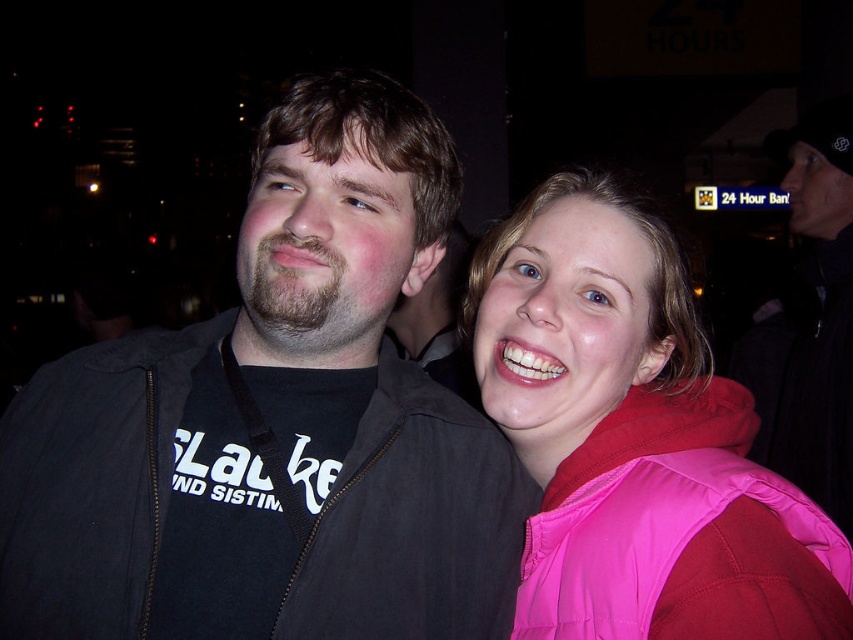
You are a photographer trying to capture a clear shot of both the pink fabric jacket at upper right and the black matte jacket at left. Since the background is dimly lit, you want to adjust your camera settings to ensure both jackets are visible. Which jacket might require more exposure adjustment due to its position relative to the other?

The pink fabric jacket at upper right is positioned over the black matte jacket at left, so it might block some light reaching the black matte jacket. Therefore, the black matte jacket at left may need more exposure adjustment to ensure it is properly lit and visible in the photo.

You are a photographer trying to capture both the point at (x=529, y=225) and the point at (x=492, y=467) in a single photo. Which point is closer to the camera?

Point (x=492, y=467) is closer to the camera than point (x=529, y=225) because the description states that point (x=529, y=225) is further away.